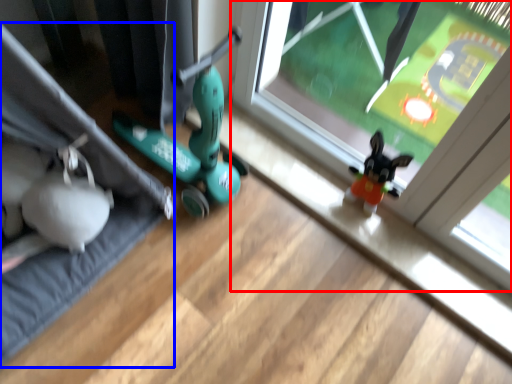
Question: Which object appears farthest to the camera in this image, window (highlighted by a red box) or yoga mat (highlighted by a blue box)?

Choices:
 (A) window
 (B) yoga mat

Answer: (A)